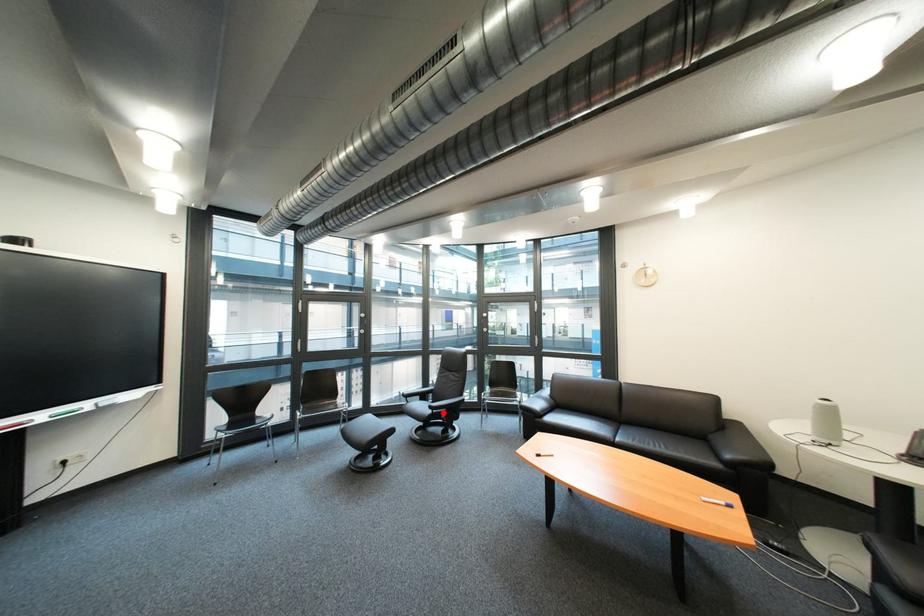
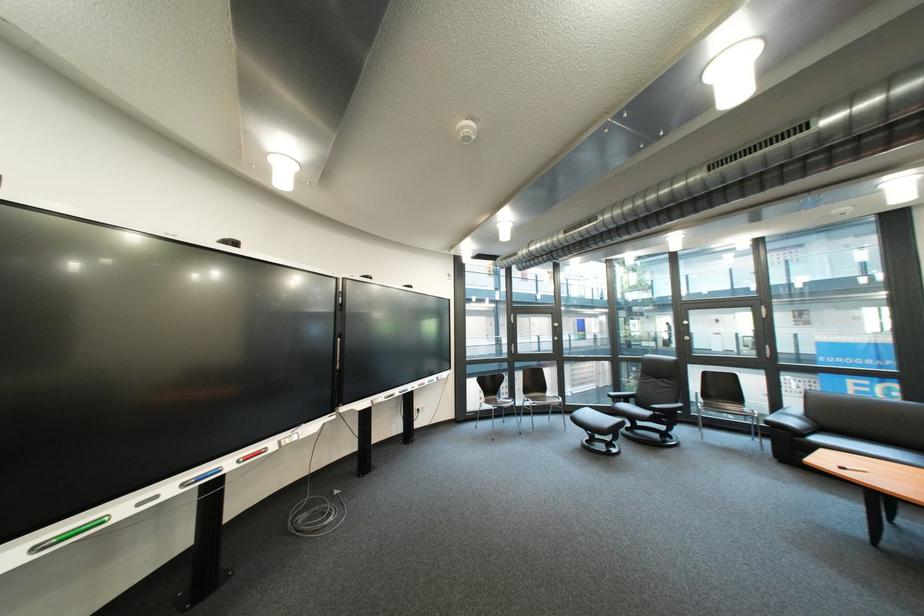
Find the pixel in the second image that matches the highlighted location in the first image.

(661, 415)